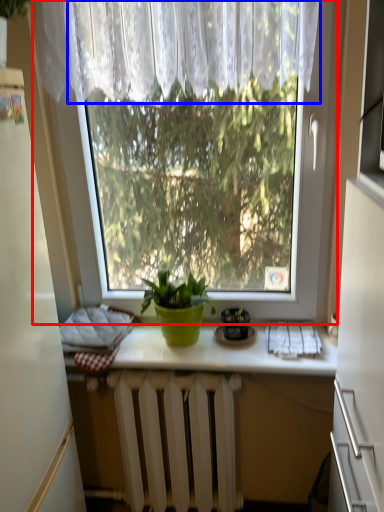
Question: Which object appears closest to the camera in this image, window (highlighted by a red box) or curtain (highlighted by a blue box)?

Choices:
 (A) window
 (B) curtain

Answer: (B)